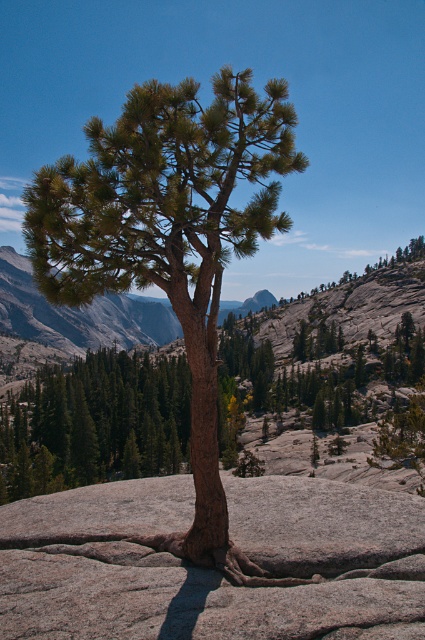
Question: Is the position of gray rough boulder at center less distant than that of brown rough bark tree at center?

Choices:
 (A) yes
 (B) no

Answer: (A)

Question: Which object is farther from the camera taking this photo?

Choices:
 (A) gray rough boulder at center
 (B) brown rough bark tree at center

Answer: (B)

Question: Does gray rough boulder at center appear on the right side of brown rough bark tree at center?

Choices:
 (A) yes
 (B) no

Answer: (A)

Question: Observing the image, what is the correct spatial positioning of gray rough boulder at center in reference to brown rough bark tree at center?

Choices:
 (A) left
 (B) right

Answer: (B)